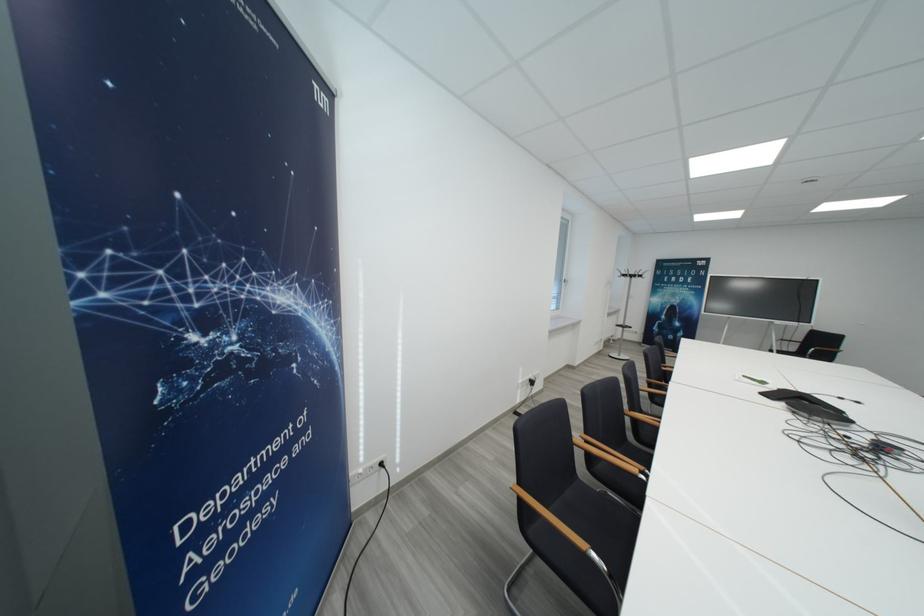
Where would you resting arm the wooden chair armrest? Please return your answer as a coordinate pair (x, y).

(558, 525)